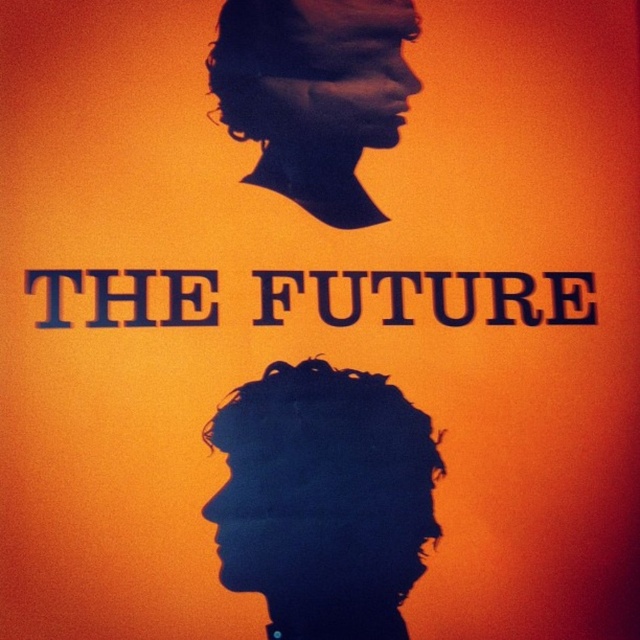
How much distance is there between dark blue textured hair at lower center and black matte profile at upper center?

The distance of dark blue textured hair at lower center from black matte profile at upper center is 10.70 inches.

Locate an element on the screen. This screenshot has height=640, width=640. dark blue textured hair at lower center is located at coordinates (323, 499).

Between point (364, 392) and point (273, 42), which one is positioned behind?

Point (273, 42)

At what (x,y) coordinates should I click in order to perform the action: click on dark blue textured hair at lower center. Please return your answer as a coordinate pair (x, y). Looking at the image, I should click on (323, 499).